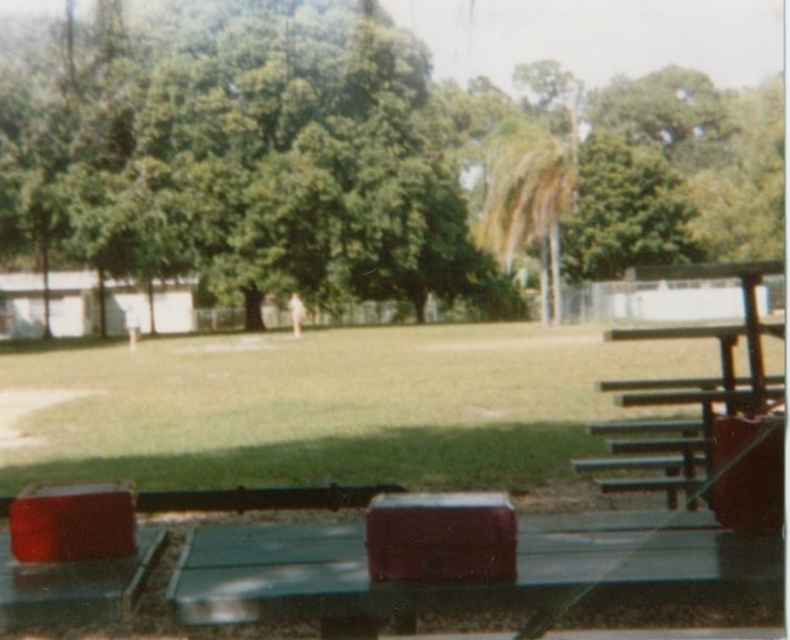
You are planning to set up a picnic area in the park. You have a large blanket that needs space. Which object, the green leafy tree at upper left or the green metal picnic table at right, would you avoid placing the blanket under to ensure it stays dry during light rain?

The green leafy tree at upper left has a larger size compared to the green metal picnic table at right, so its canopy would provide more shelter from rain. Therefore, placing the blanket under the green leafy tree at upper left would keep it drier, so you should avoid placing it under the smaller green metal picnic table at right.

You are planning to set up a small outdoor event in the park. You need to know which object occupies more horizontal space between the green leafy tree at upper left and the metallic green picnic table at lower center to decide where to place decorations. Which one is wider?

The green leafy tree at upper left is wider than the metallic green picnic table at lower center according to the description.